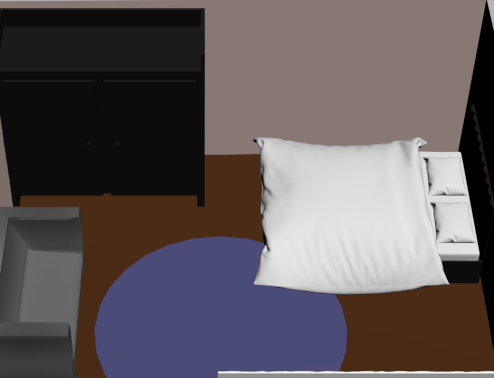
This screenshot has height=378, width=494. What are the coordinates of `armoir` in the screenshot? It's located at (171, 128).